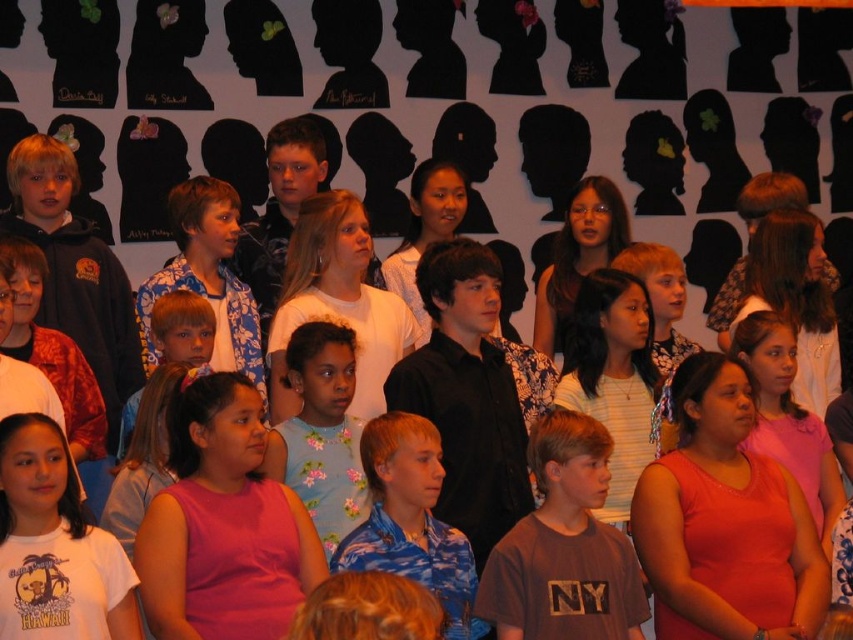
Is brown cotton t-shirt at center closer to the viewer compared to floral fabric dress at center?

Yes, brown cotton t-shirt at center is closer to the viewer.

Does brown cotton t-shirt at center have a lesser height compared to floral fabric dress at center?

Correct, brown cotton t-shirt at center is not as tall as floral fabric dress at center.

Who is more distant from viewer, (532,525) or (357,461)?

The point (357,461) is more distant.

Where is `brown cotton t-shirt at center`? This screenshot has height=640, width=853. brown cotton t-shirt at center is located at coordinates (564, 547).